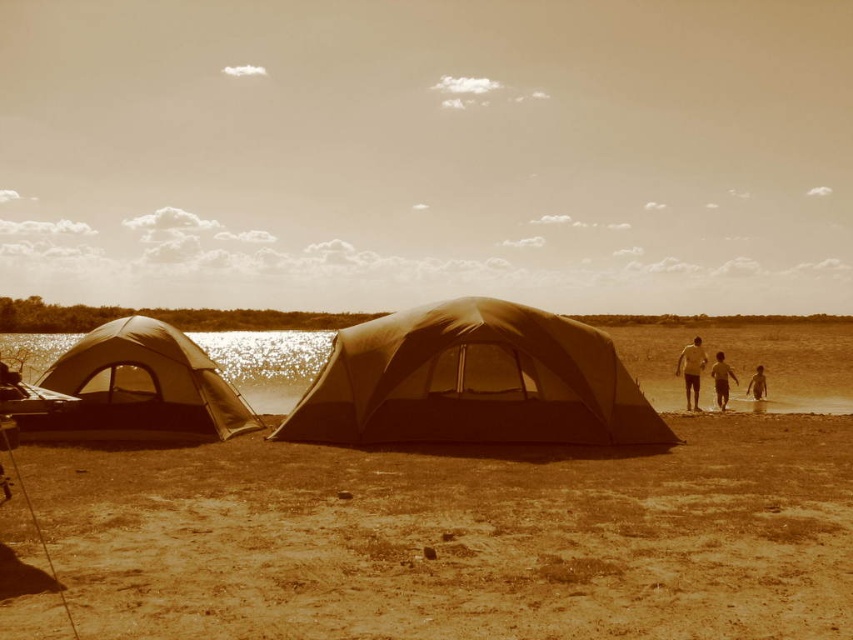
Question: Among these objects, which one is farthest from the camera?

Choices:
 (A) tan skin person at center
 (B) tan skin person at right

Answer: (B)

Question: Does translucent water at center appear over tan skin person at center?

Choices:
 (A) no
 (B) yes

Answer: (B)

Question: Which of the following is the closest to the observer?

Choices:
 (A) (198, 384)
 (B) (270, 355)
 (C) (695, 380)

Answer: (A)

Question: Is dull brown dirt at center smaller than matte black tent at center?

Choices:
 (A) no
 (B) yes

Answer: (B)

Question: Which point is farther to the camera?

Choices:
 (A) (718, 356)
 (B) (698, 353)

Answer: (A)

Question: Can you confirm if matte black tent at center is thinner than tan skin person at right?

Choices:
 (A) no
 (B) yes

Answer: (A)